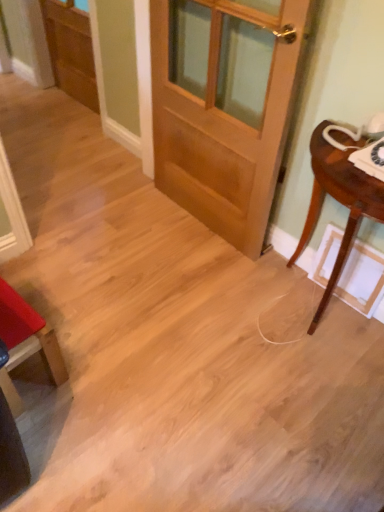
Find the location of a particular element. The height and width of the screenshot is (512, 384). vacant region below mahogany wood table at right (from a real-world perspective) is located at coordinates (323, 316).